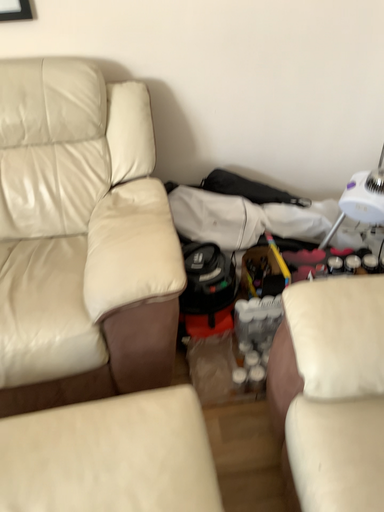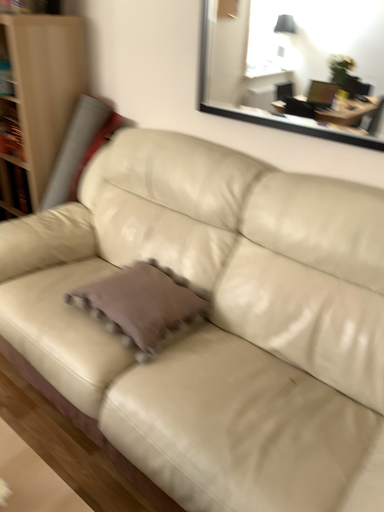
Question: Which way did the camera rotate in the video?

Choices:
 (A) rotated right
 (B) rotated left

Answer: (B)